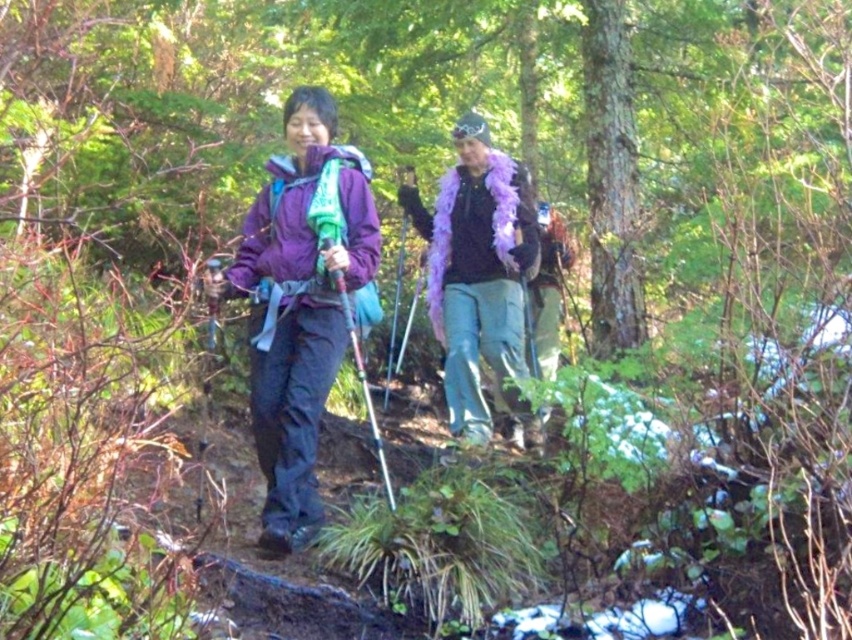
Who is more distant from viewer, (x=298, y=404) or (x=413, y=196)?

Positioned behind is point (x=413, y=196).

This screenshot has height=640, width=852. Describe the element at coordinates (301, 301) in the screenshot. I see `purple softshell jacket at center` at that location.

The image size is (852, 640). I want to click on purple softshell jacket at center, so click(301, 301).